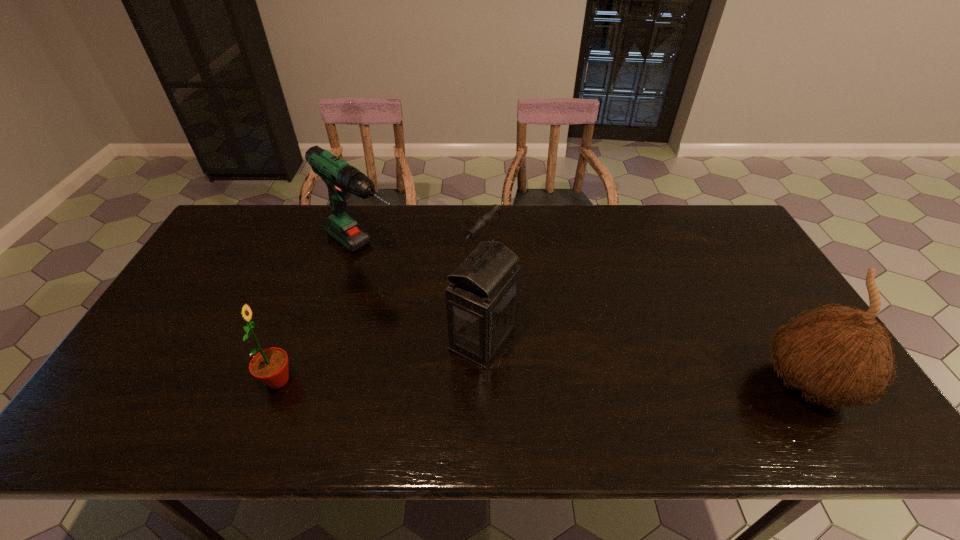
The height and width of the screenshot is (540, 960). Find the location of `free spot at the left edge of the desktop`. free spot at the left edge of the desktop is located at coordinates (234, 282).

In the image, there is a desktop. Identify the location of blank space at the right edge. (768, 280).

The height and width of the screenshot is (540, 960). In the image, there is a desktop. In order to click on free space at the far left corner in this screenshot , I will do `click(244, 228)`.

The height and width of the screenshot is (540, 960). What are the coordinates of `unoccupied position between the farthest object and the tallest object` in the screenshot? It's located at [x=423, y=294].

Locate an element on the screen. The image size is (960, 540). blank region between the drill and the third object from left to right is located at coordinates click(x=423, y=294).

You are a GUI agent. You are given a task and a screenshot of the screen. Output one action in this format:
    pyautogui.click(x=<x>, y=<y>)
    Task: Click on the unoccupied position between the shortest object and the farthest object
    The height and width of the screenshot is (540, 960).
    Given the screenshot: What is the action you would take?
    pyautogui.click(x=321, y=315)

What are the coordinates of `free space between the rightmost object and the shortest object` in the screenshot? It's located at (542, 382).

You are a GUI agent. You are given a task and a screenshot of the screen. Output one action in this format:
    pyautogui.click(x=<x>, y=<y>)
    Task: Click on the free space between the shortest object and the rightmost object
    The width and height of the screenshot is (960, 540).
    Given the screenshot: What is the action you would take?
    pyautogui.click(x=542, y=382)

You are a GUI agent. You are given a task and a screenshot of the screen. Output one action in this format:
    pyautogui.click(x=<x>, y=<y>)
    Task: Click on the vacant area that lies between the drill and the coconut
    
    Given the screenshot: What is the action you would take?
    pyautogui.click(x=586, y=318)

Locate an element on the screen. This screenshot has width=960, height=540. vacant area between the coconut and the drill is located at coordinates (586, 318).